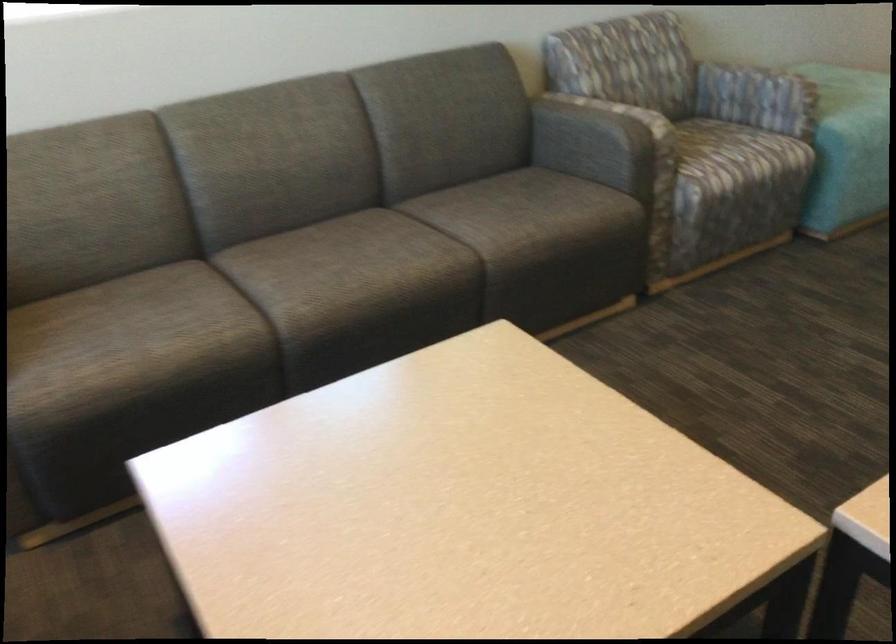
Find the location of a particular element. grey sofa armrest is located at coordinates tap(597, 140).